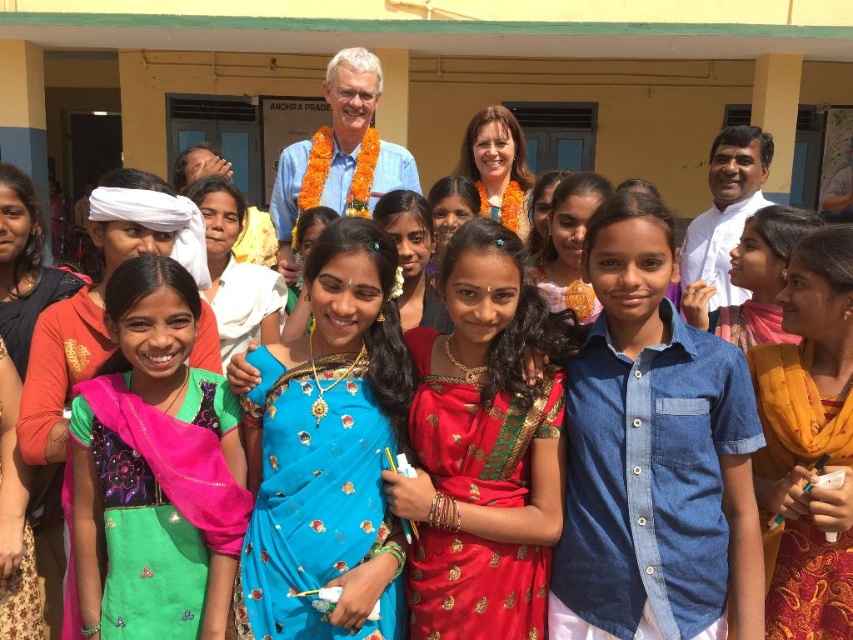
Who is lower down, denim shirt at center or shiny red sari at center?

Positioned lower is shiny red sari at center.

Locate an element on the screen. The height and width of the screenshot is (640, 853). denim shirt at center is located at coordinates (653, 452).

Is point (711, 531) positioned in front of point (491, 433)?

Yes, it is.

This screenshot has width=853, height=640. Identify the location of denim shirt at center. (653, 452).

Which is in front, point (332, 584) or point (526, 284)?

Point (332, 584) is more forward.

Is blue silk saree at center positioned at the back of shiny red sari at center?

No.

Where is `blue silk saree at center`? The image size is (853, 640). blue silk saree at center is located at coordinates (329, 451).

Does shiny red sari at center appear over green silk saree at center?

Correct, shiny red sari at center is located above green silk saree at center.

Which is more to the right, shiny red sari at center or green silk saree at center?

Positioned to the right is shiny red sari at center.

Where is `shiny red sari at center`? The height and width of the screenshot is (640, 853). shiny red sari at center is located at coordinates (480, 451).

This screenshot has width=853, height=640. I want to click on shiny red sari at center, so click(x=480, y=451).